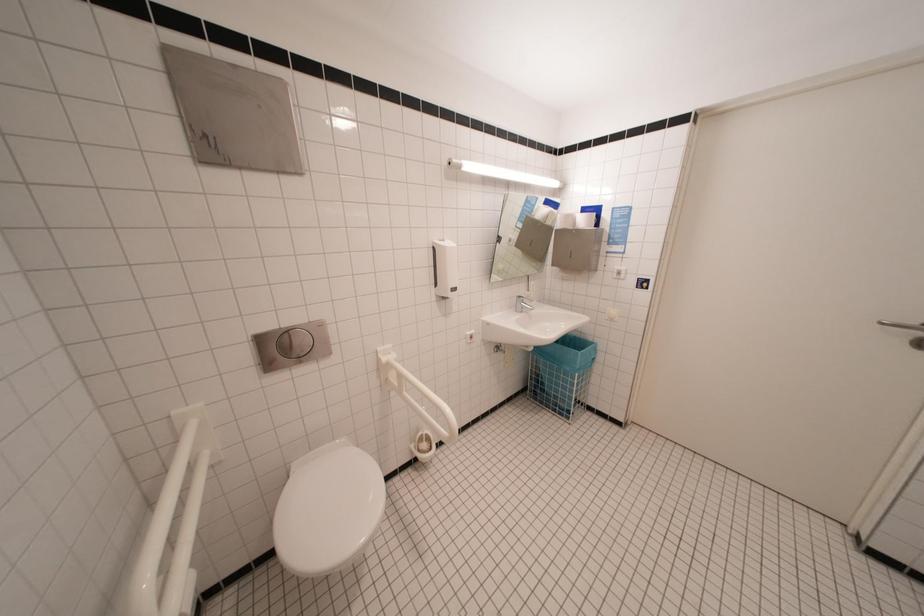
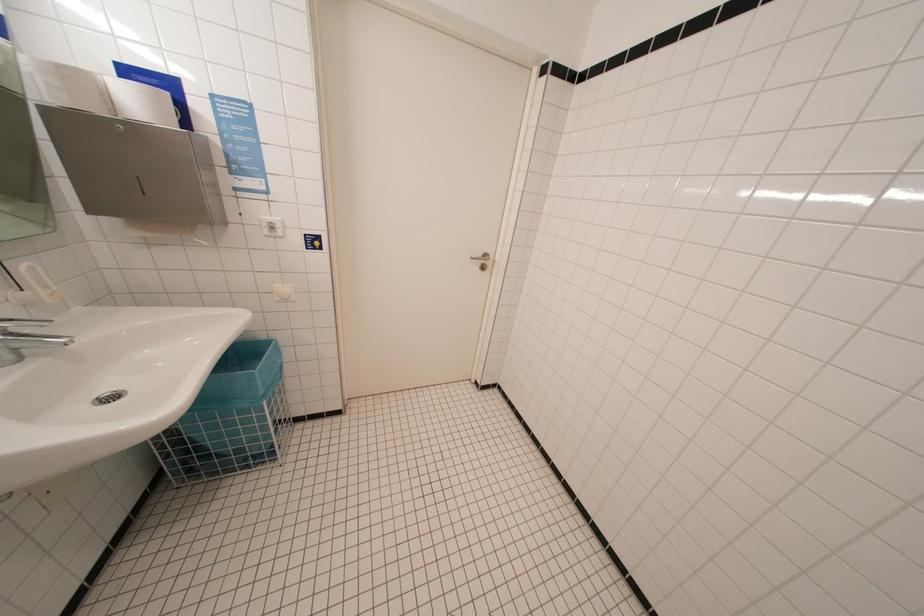
How did the camera likely rotate?

The camera's rotation is toward right-down.